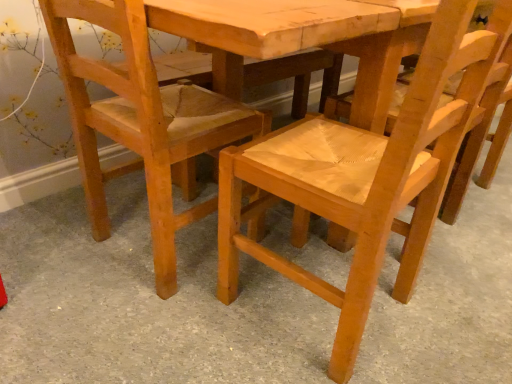
What are the coordinates of `vacant space underneath natural wood chair at center, the first chair from the right (from a real-world perspective)` in the screenshot? It's located at (324, 304).